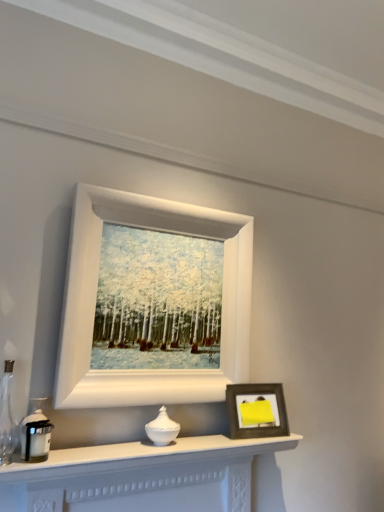
Describe the element at coordinates (140, 476) in the screenshot. I see `white matte fireplace at lower center` at that location.

Measure the distance between white glossy vase at center, acting as the 1th candle holder starting from the right, and camera.

white glossy vase at center, acting as the 1th candle holder starting from the right, is 1.36 meters from camera.

Where is `matte black candle holder at left, arranged as the second candle holder when viewed from the back`? matte black candle holder at left, arranged as the second candle holder when viewed from the back is located at coordinates (35, 434).

Is wooden photo frame at lower right, the first picture frame in the bottom-to-top sequence, far away from white matte picture frame at upper center, placed as the 2th picture frame when sorted from bottom to top?

wooden photo frame at lower right, the first picture frame in the bottom-to-top sequence, is actually quite close to white matte picture frame at upper center, placed as the 2th picture frame when sorted from bottom to top.

From a real-world perspective, is wooden photo frame at lower right, which is counted as the second picture frame, starting from the top, positioned above or below white matte picture frame at upper center, placed as the 2th picture frame when sorted from bottom to top?

From a real-world perspective, wooden photo frame at lower right, which is counted as the second picture frame, starting from the top, is physically below white matte picture frame at upper center, placed as the 2th picture frame when sorted from bottom to top.

Is wooden photo frame at lower right, the first picture frame in the bottom-to-top sequence, in front of or behind white matte picture frame at upper center, arranged as the 1th picture frame when viewed from the top, in the image?

Visually, wooden photo frame at lower right, the first picture frame in the bottom-to-top sequence, is located behind white matte picture frame at upper center, arranged as the 1th picture frame when viewed from the top.

What's the angular difference between wooden photo frame at lower right, the first picture frame in the bottom-to-top sequence, and white matte picture frame at upper center, placed as the 2th picture frame when sorted from bottom to top,'s facing directions?

They differ by 8.36 degrees in their facing directions.

Can you confirm if matte black candle holder at left, the 1th candle holder in the left-to-right sequence, is shorter than white glossy vase at center, the first candle holder when ordered from back to front?

No, matte black candle holder at left, the 1th candle holder in the left-to-right sequence, is not shorter than white glossy vase at center, the first candle holder when ordered from back to front.

Locate an element on the screen. Image resolution: width=384 pixels, height=512 pixels. candle holder on the left of white glossy vase at center, acting as the 1th candle holder starting from the right is located at coordinates (35, 434).

Is matte black candle holder at left, the 1th candle holder in the left-to-right sequence, positioned with its back to white glossy vase at center, the second candle holder viewed from the front?

No, matte black candle holder at left, the 1th candle holder in the left-to-right sequence, is not facing away from white glossy vase at center, the second candle holder viewed from the front.

Which object is further away from the camera taking this photo, matte black candle holder at left, the 1th candle holder in the left-to-right sequence, or white matte picture frame at upper center, arranged as the 1th picture frame when viewed from the top?

white matte picture frame at upper center, arranged as the 1th picture frame when viewed from the top, is more distant.

Can you confirm if matte black candle holder at left, which appears as the 2th candle holder when viewed from the right, is wider than white matte picture frame at upper center, placed as the 2th picture frame when sorted from bottom to top?

Incorrect, the width of matte black candle holder at left, which appears as the 2th candle holder when viewed from the right, does not surpass that of white matte picture frame at upper center, placed as the 2th picture frame when sorted from bottom to top.

Does matte black candle holder at left, which is the first candle holder in front-to-back order, have a lesser height compared to white matte picture frame at upper center, placed as the 2th picture frame when sorted from bottom to top?

Correct, matte black candle holder at left, which is the first candle holder in front-to-back order, is not as tall as white matte picture frame at upper center, placed as the 2th picture frame when sorted from bottom to top.

From a real-world perspective, who is located higher, matte black candle holder at left, arranged as the second candle holder when viewed from the back, or white matte picture frame at upper center, placed as the 2th picture frame when sorted from bottom to top?

white matte picture frame at upper center, placed as the 2th picture frame when sorted from bottom to top, is physically above.

Looking at their sizes, would you say wooden photo frame at lower right, which is counted as the second picture frame, starting from the top, is wider or thinner than white matte fireplace at lower center?

Considering their sizes, wooden photo frame at lower right, which is counted as the second picture frame, starting from the top, looks slimmer than white matte fireplace at lower center.

Is wooden photo frame at lower right, which is counted as the second picture frame, starting from the top, beside white matte fireplace at lower center?

No, wooden photo frame at lower right, which is counted as the second picture frame, starting from the top, is not with white matte fireplace at lower center.

Which is behind, point (264, 394) or point (235, 505)?

The point (264, 394) is behind.

Which object is positioned more to the left, wooden photo frame at lower right, which is counted as the second picture frame, starting from the top, or white matte fireplace at lower center?

Positioned to the left is white matte fireplace at lower center.

Which is nearer, (x=235, y=365) or (x=269, y=428)?

The point (x=269, y=428) is closer to the camera.

Which object is wider, white matte picture frame at upper center, placed as the 2th picture frame when sorted from bottom to top, or wooden photo frame at lower right, which is counted as the second picture frame, starting from the top?

white matte picture frame at upper center, placed as the 2th picture frame when sorted from bottom to top, is wider.

Which of these two, white matte picture frame at upper center, placed as the 2th picture frame when sorted from bottom to top, or wooden photo frame at lower right, the first picture frame in the bottom-to-top sequence, stands taller?

white matte picture frame at upper center, placed as the 2th picture frame when sorted from bottom to top, is taller.

From the image's perspective, is white matte picture frame at upper center, placed as the 2th picture frame when sorted from bottom to top, over wooden photo frame at lower right, the first picture frame in the bottom-to-top sequence?

Yes, from the image's perspective, white matte picture frame at upper center, placed as the 2th picture frame when sorted from bottom to top, is above wooden photo frame at lower right, the first picture frame in the bottom-to-top sequence.

From the image's perspective, is white matte fireplace at lower center under white glossy vase at center, which is counted as the second candle holder, starting from the left?

Indeed, from the image's perspective, white matte fireplace at lower center is shown beneath white glossy vase at center, which is counted as the second candle holder, starting from the left.

Does white matte fireplace at lower center have a larger size compared to white glossy vase at center, the first candle holder when ordered from back to front?

Yes.

I want to click on table that is below the white glossy vase at center, the first candle holder when ordered from back to front (from the image's perspective), so click(x=140, y=476).

Would you consider white matte fireplace at lower center to be distant from white glossy vase at center, acting as the 1th candle holder starting from the right?

They are positioned close to each other.

Is white glossy vase at center, acting as the 1th candle holder starting from the right, at the right side of white matte picture frame at upper center, arranged as the 1th picture frame when viewed from the top?

In fact, white glossy vase at center, acting as the 1th candle holder starting from the right, is to the left of white matte picture frame at upper center, arranged as the 1th picture frame when viewed from the top.

This screenshot has width=384, height=512. I want to click on picture frame that is the 2nd one when counting upward from the white glossy vase at center, acting as the 1th candle holder starting from the right (from the image's perspective), so click(x=95, y=303).

How different are the orientations of white glossy vase at center, which is counted as the second candle holder, starting from the left, and white matte picture frame at upper center, arranged as the 1th picture frame when viewed from the top, in degrees?

There is a 0.355-degree angle between the facing directions of white glossy vase at center, which is counted as the second candle holder, starting from the left, and white matte picture frame at upper center, arranged as the 1th picture frame when viewed from the top.

From the picture: Which of these two, white glossy vase at center, acting as the 1th candle holder starting from the right, or white matte picture frame at upper center, placed as the 2th picture frame when sorted from bottom to top, is wider?

white glossy vase at center, acting as the 1th candle holder starting from the right.

This screenshot has height=512, width=384. Identify the location of picture frame located below the white matte picture frame at upper center, placed as the 2th picture frame when sorted from bottom to top (from the image's perspective). (256, 407).

The width and height of the screenshot is (384, 512). I want to click on candle holder above the white glossy vase at center, the first candle holder when ordered from back to front (from the image's perspective), so click(x=35, y=434).

Looking at the image, which one is located further to white glossy vase at center, the second candle holder viewed from the front, white matte fireplace at lower center or wooden photo frame at lower right, the first picture frame in the bottom-to-top sequence?

Based on the image, wooden photo frame at lower right, the first picture frame in the bottom-to-top sequence, appears to be further to white glossy vase at center, the second candle holder viewed from the front.

Considering their positions, is wooden photo frame at lower right, which is counted as the second picture frame, starting from the top, positioned closer to white glossy vase at center, which is counted as the second candle holder, starting from the left, than white matte fireplace at lower center?

white matte fireplace at lower center is closer to white glossy vase at center, which is counted as the second candle holder, starting from the left.

Looking at the image, which one is located closer to white matte picture frame at upper center, arranged as the 1th picture frame when viewed from the top, white matte fireplace at lower center or wooden photo frame at lower right, which is counted as the second picture frame, starting from the top?

wooden photo frame at lower right, which is counted as the second picture frame, starting from the top, is positioned closer to the anchor white matte picture frame at upper center, arranged as the 1th picture frame when viewed from the top.

Considering their positions, is white matte fireplace at lower center positioned closer to wooden photo frame at lower right, the first picture frame in the bottom-to-top sequence, than white matte picture frame at upper center, arranged as the 1th picture frame when viewed from the top?

white matte fireplace at lower center is closer to wooden photo frame at lower right, the first picture frame in the bottom-to-top sequence.

When comparing their distances from matte black candle holder at left, which is the first candle holder in front-to-back order, does white glossy vase at center, the second candle holder viewed from the front, or wooden photo frame at lower right, the first picture frame in the bottom-to-top sequence, seem closer?

white glossy vase at center, the second candle holder viewed from the front.

When comparing their distances from matte black candle holder at left, arranged as the second candle holder when viewed from the back, does white matte picture frame at upper center, arranged as the 1th picture frame when viewed from the top, or wooden photo frame at lower right, the first picture frame in the bottom-to-top sequence, seem closer?

white matte picture frame at upper center, arranged as the 1th picture frame when viewed from the top, lies closer to matte black candle holder at left, arranged as the second candle holder when viewed from the back, than the other object.

When comparing their distances from wooden photo frame at lower right, the first picture frame in the bottom-to-top sequence, does matte black candle holder at left, which appears as the 2th candle holder when viewed from the right, or white matte picture frame at upper center, arranged as the 1th picture frame when viewed from the top, seem further?

Among the two, matte black candle holder at left, which appears as the 2th candle holder when viewed from the right, is located further to wooden photo frame at lower right, the first picture frame in the bottom-to-top sequence.

Estimate the real-world distances between objects in this image. Which object is further from white glossy vase at center, the second candle holder viewed from the front, wooden photo frame at lower right, the first picture frame in the bottom-to-top sequence, or matte black candle holder at left, which is the first candle holder in front-to-back order?

matte black candle holder at left, which is the first candle holder in front-to-back order, is further to white glossy vase at center, the second candle holder viewed from the front.

Identify the location of picture frame between white matte picture frame at upper center, placed as the 2th picture frame when sorted from bottom to top, and white glossy vase at center, the second candle holder viewed from the front, in the up-down direction. Image resolution: width=384 pixels, height=512 pixels. (256, 407).

You are a GUI agent. You are given a task and a screenshot of the screen. Output one action in this format:
    pyautogui.click(x=<x>, y=<y>)
    Task: Click on the candle holder between white matte picture frame at upper center, arranged as the 1th picture frame when viewed from the top, and white glossy vase at center, which is counted as the second candle holder, starting from the left, in the vertical direction
    Image resolution: width=384 pixels, height=512 pixels.
    Given the screenshot: What is the action you would take?
    pyautogui.click(x=35, y=434)

Identify the location of candle holder situated between matte black candle holder at left, which is the first candle holder in front-to-back order, and wooden photo frame at lower right, which is counted as the second picture frame, starting from the top, from left to right. This screenshot has height=512, width=384. (162, 429).

Where is `picture frame between white matte picture frame at upper center, placed as the 2th picture frame when sorted from bottom to top, and white matte fireplace at lower center from top to bottom`? picture frame between white matte picture frame at upper center, placed as the 2th picture frame when sorted from bottom to top, and white matte fireplace at lower center from top to bottom is located at coordinates (256, 407).